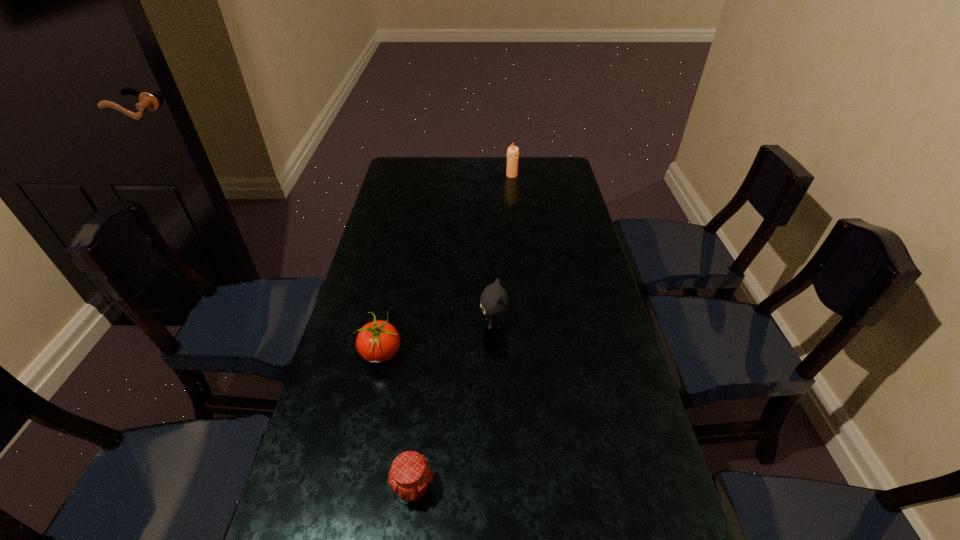
Where is `candle`? This screenshot has height=540, width=960. candle is located at coordinates (513, 151).

Identify the location of the rightmost object. This screenshot has height=540, width=960. pyautogui.click(x=513, y=151).

At what (x,y) coordinates should I click in order to perform the action: click on kitten. Please return your answer as a coordinate pair (x, y). Looking at the image, I should click on (494, 299).

At what (x,y) coordinates should I click in order to perform the action: click on tomato. Please return your answer as a coordinate pair (x, y). The width and height of the screenshot is (960, 540). Looking at the image, I should click on (378, 341).

Locate an element on the screen. This screenshot has width=960, height=540. jam is located at coordinates (410, 477).

You are a GUI agent. You are given a task and a screenshot of the screen. Output one action in this format:
    pyautogui.click(x=<x>, y=<y>)
    Task: Click on the nearest object
    Image resolution: width=960 pixels, height=540 pixels.
    Given the screenshot: What is the action you would take?
    pyautogui.click(x=410, y=477)

Identify the location of free spot located on the front of the candle. Image resolution: width=960 pixels, height=540 pixels. point(514,194).

Where is `vacant space positioned 0.220m on the front-facing side of the kitten`? vacant space positioned 0.220m on the front-facing side of the kitten is located at coordinates (399, 324).

The image size is (960, 540). I want to click on free location located on the front-facing side of the kitten, so click(x=410, y=324).

At what (x,y) coordinates should I click in order to perform the action: click on vacant area located 0.230m on the front-facing side of the kitten. Please return your answer as a coordinate pair (x, y). Looking at the image, I should click on (396, 324).